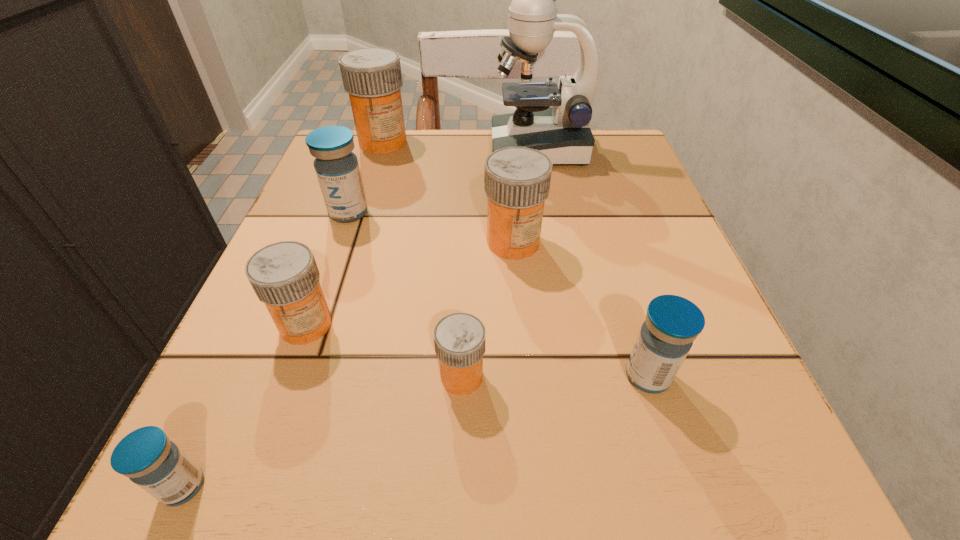
Where is `vacant point that satisfies the following two spatial constraints: 1. on the label side of the rightmost blue medicine; 2. on the left side of the rightmost orange medicine`? The height and width of the screenshot is (540, 960). vacant point that satisfies the following two spatial constraints: 1. on the label side of the rightmost blue medicine; 2. on the left side of the rightmost orange medicine is located at coordinates (524, 376).

At what (x,y) coordinates should I click in order to perform the action: click on vacant position in the image that satisfies the following two spatial constraints: 1. at the eyepiece of the tallest object; 2. on the label side of the third biggest orange medicine. Please return your answer as a coordinate pair (x, y). This screenshot has height=540, width=960. Looking at the image, I should click on (572, 325).

The image size is (960, 540). Identify the location of vacant position in the image that satisfies the following two spatial constraints: 1. on the label side of the rightmost blue medicine; 2. on the right side of the biggest orange medicine. (309, 376).